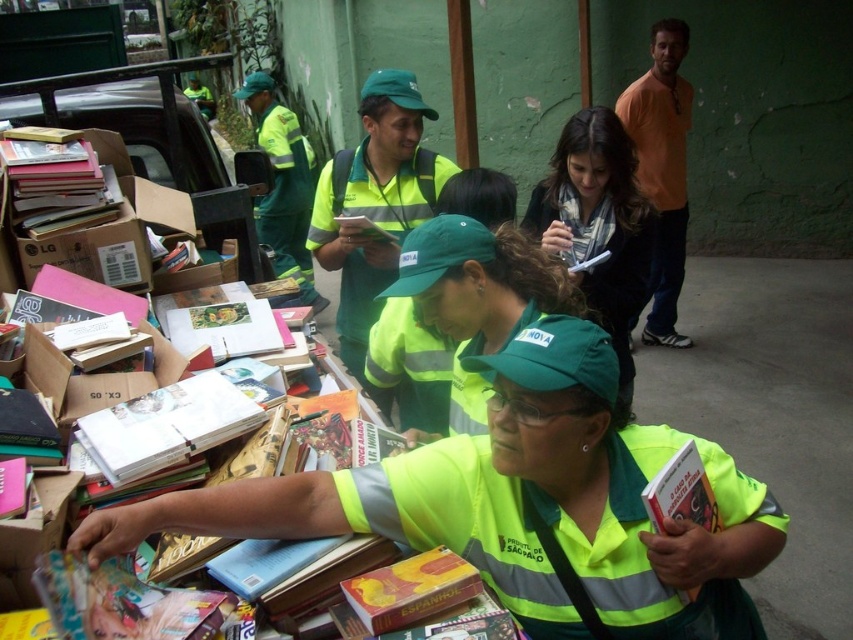
You are a delivery person who needs to locate the green reflective vest at center in the image. According to the coordinates provided, where exactly is it positioned?

The green reflective vest at center is located at coordinates point (520,506).

You are a visitor at this book distribution event. You notice two people in the crowd wearing the green reflective uniform at center and the orange cotton shirt at upper right. Which person is standing closer to the front of the event area?

The green reflective uniform at center is positioned under the orange cotton shirt at upper right, meaning the green reflective uniform at center is closer to the front of the event area.

Where is the matte green scarf at center located in the image?

The matte green scarf at center is located at the point with coordinates 0.350 in the x axis and 0.702 in the y axis.